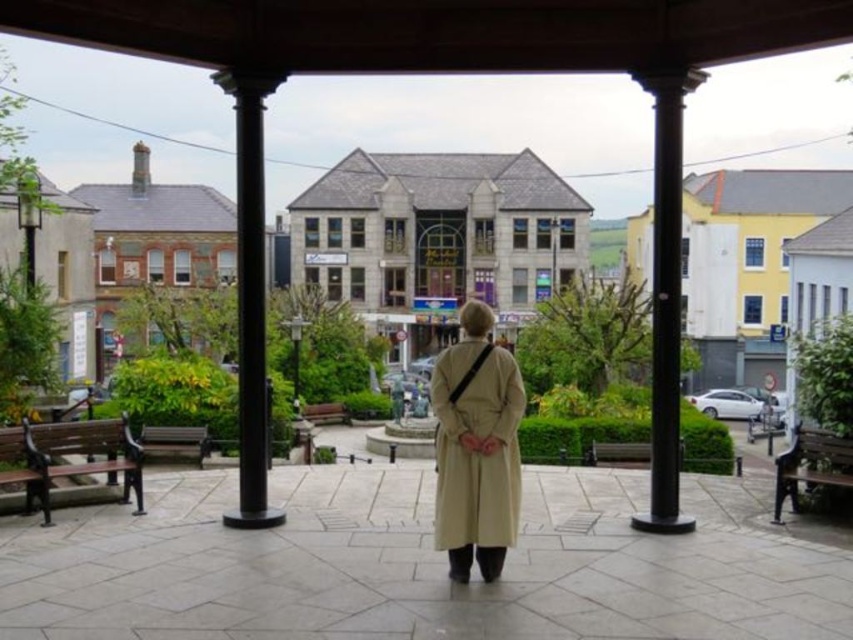
Does wooden bench at left appear on the right side of wooden bench at center?

Indeed, wooden bench at left is positioned on the right side of wooden bench at center.

The image size is (853, 640). Find the location of `wooden bench at left`. wooden bench at left is located at coordinates (70, 452).

Find the location of `wooden bench at left`. wooden bench at left is located at coordinates (70, 452).

Between beige fabric trench coat at center and metallic gray lamp post at center, which one is positioned lower?

metallic gray lamp post at center

Who is higher up, beige fabric trench coat at center or metallic gray lamp post at center?

Positioned higher is beige fabric trench coat at center.

Is point (489, 465) closer to viewer compared to point (287, 330)?

Yes, it is.

Identify the location of beige fabric trench coat at center. Image resolution: width=853 pixels, height=640 pixels. (476, 451).

Who is shorter, wooden bench at center or metallic gray lamp post at center?

wooden bench at center

Is wooden bench at center further to camera compared to metallic gray lamp post at center?

No, wooden bench at center is in front of metallic gray lamp post at center.

Where is `wooden bench at center`? This screenshot has width=853, height=640. wooden bench at center is located at coordinates (173, 442).